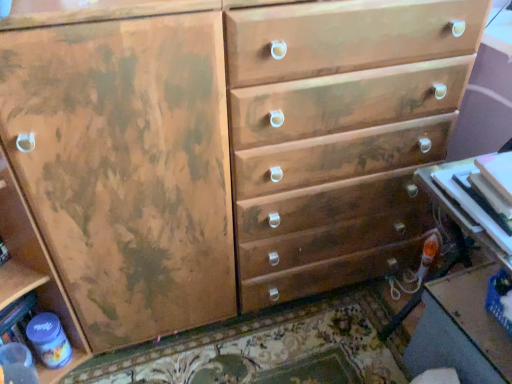
What do you see at coordinates (461, 330) in the screenshot?
I see `matte plastic table at lower right, the first table when ordered from back to front` at bounding box center [461, 330].

In order to face matte plastic bottle at lower left, should I rotate leftwards or rightwards?

Rotate your view left by about 25.345°.

This screenshot has height=384, width=512. What do you see at coordinates (466, 207) in the screenshot?
I see `white glossy table at lower right, which ranks as the 1th table in front-to-back order` at bounding box center [466, 207].

At what (x,y) coordinates should I click in order to perform the action: click on matte plastic table at lower right, marked as the first table in a bottom-to-top arrangement. Please return your answer as a coordinate pair (x, y). Looking at the image, I should click on (461, 330).

Is point (481, 291) closer to camera compared to point (41, 315)?

Yes, point (481, 291) is closer to viewer.

Is matte plastic table at lower right, which is counted as the second table, starting from the front, aimed at matte plastic bottle at lower left?

No, matte plastic table at lower right, which is counted as the second table, starting from the front, is not facing towards matte plastic bottle at lower left.

Are matte plastic table at lower right, acting as the second table starting from the top, and matte plastic bottle at lower left making contact?

No.

From the image's perspective, which one is positioned higher, white glossy table at lower right, which ranks as the 1th table in front-to-back order, or matte plastic bottle at lower left?

white glossy table at lower right, which ranks as the 1th table in front-to-back order.

Could you tell me if white glossy table at lower right, the 2th table positioned from the bottom, is facing matte plastic bottle at lower left?

No, white glossy table at lower right, the 2th table positioned from the bottom, is not facing towards matte plastic bottle at lower left.

Is white glossy table at lower right, the 2th table positioned from the bottom, taller than matte plastic bottle at lower left?

In fact, white glossy table at lower right, the 2th table positioned from the bottom, may be shorter than matte plastic bottle at lower left.

Does white glossy table at lower right, which ranks as the 1th table in front-to-back order, touch matte plastic bottle at lower left?

No.

From the image's perspective, which is above, matte plastic table at lower right, acting as the second table starting from the top, or white glossy table at lower right, which ranks as the 1th table in front-to-back order?

From the image's view, white glossy table at lower right, which ranks as the 1th table in front-to-back order, is above.

Measure the distance from matte plastic table at lower right, marked as the first table in a bottom-to-top arrangement, to white glossy table at lower right, positioned as the 2th table in back-to-front order.

matte plastic table at lower right, marked as the first table in a bottom-to-top arrangement, is 10.59 inches from white glossy table at lower right, positioned as the 2th table in back-to-front order.

Looking at this image, would you say matte plastic table at lower right, the first table when ordered from back to front, is a long distance from white glossy table at lower right, which ranks as the 1th table in front-to-back order?

No.

In terms of height, does matte plastic table at lower right, which is counted as the second table, starting from the front, look taller or shorter compared to white glossy table at lower right, the 2th table positioned from the bottom?

matte plastic table at lower right, which is counted as the second table, starting from the front, is taller than white glossy table at lower right, the 2th table positioned from the bottom.

Does point (433, 173) come farther from viewer compared to point (468, 317)?

No, it is not.

From a real-world perspective, which is physically above, white glossy table at lower right, positioned as the 2th table in back-to-front order, or matte plastic table at lower right, acting as the second table starting from the top?

white glossy table at lower right, positioned as the 2th table in back-to-front order, is physically above.

Based on the photo, could you tell me if white glossy table at lower right, the 2th table positioned from the bottom, is turned towards matte plastic table at lower right, the first table when ordered from back to front?

No, white glossy table at lower right, the 2th table positioned from the bottom, is not facing towards matte plastic table at lower right, the first table when ordered from back to front.

Between white glossy table at lower right, positioned as the 2th table in back-to-front order, and matte plastic table at lower right, marked as the first table in a bottom-to-top arrangement, which one has smaller size?

Smaller between the two is white glossy table at lower right, positioned as the 2th table in back-to-front order.

Is matte plastic bottle at lower left shorter than matte plastic table at lower right, which is counted as the second table, starting from the front?

Correct, matte plastic bottle at lower left is not as tall as matte plastic table at lower right, which is counted as the second table, starting from the front.

Looking at this image, does matte plastic bottle at lower left have a larger size compared to matte plastic table at lower right, marked as the first table in a bottom-to-top arrangement?

No.

Where is `bottle behind the matte plastic table at lower right, the first table when ordered from back to front`? bottle behind the matte plastic table at lower right, the first table when ordered from back to front is located at coordinates (49, 340).

From a real-world perspective, is matte plastic bottle at lower left located beneath white glossy table at lower right, which ranks as the 1th table in front-to-back order?

Yes, from a real-world perspective, matte plastic bottle at lower left is under white glossy table at lower right, which ranks as the 1th table in front-to-back order.

Between point (48, 317) and point (511, 243), which one is positioned in front?

The point (511, 243) is more forward.

Between matte plastic bottle at lower left and white glossy table at lower right, positioned as the 2th table in back-to-front order, which one has larger width?

white glossy table at lower right, positioned as the 2th table in back-to-front order.

Between matte plastic bottle at lower left and white glossy table at lower right, positioned as the 2th table in back-to-front order, which one has larger size?

Bigger between the two is white glossy table at lower right, positioned as the 2th table in back-to-front order.

Find the location of `the 2nd table to the right of the matte plastic bottle at lower left, starting your count from the anchor`. the 2nd table to the right of the matte plastic bottle at lower left, starting your count from the anchor is located at coordinates (461, 330).

Locate an element on the screen. The image size is (512, 384). the 2nd table located above the matte plastic bottle at lower left (from a real-world perspective) is located at coordinates (466, 207).

Looking at the image, which one is located further to matte plastic table at lower right, acting as the second table starting from the top, white glossy table at lower right, the 2th table positioned from the bottom, or matte plastic bottle at lower left?

The object further to matte plastic table at lower right, acting as the second table starting from the top, is matte plastic bottle at lower left.

Estimate the real-world distances between objects in this image. Which object is further from white glossy table at lower right, the first table in the top-to-bottom sequence, matte plastic table at lower right, the first table when ordered from back to front, or matte plastic bottle at lower left?

The object further to white glossy table at lower right, the first table in the top-to-bottom sequence, is matte plastic bottle at lower left.

When comparing their distances from matte plastic bottle at lower left, does white glossy table at lower right, which ranks as the 1th table in front-to-back order, or matte plastic table at lower right, acting as the second table starting from the top, seem closer?

matte plastic table at lower right, acting as the second table starting from the top, is positioned closer to the anchor matte plastic bottle at lower left.

Looking at the image, which one is located further to matte plastic bottle at lower left, matte plastic table at lower right, the first table when ordered from back to front, or white glossy table at lower right, the first table in the top-to-bottom sequence?

white glossy table at lower right, the first table in the top-to-bottom sequence, lies further to matte plastic bottle at lower left than the other object.

When comparing their distances from matte plastic table at lower right, which is counted as the second table, starting from the front, does matte plastic bottle at lower left or white glossy table at lower right, the first table in the top-to-bottom sequence, seem further?

matte plastic bottle at lower left.

Estimate the real-world distances between objects in this image. Which object is further from white glossy table at lower right, which ranks as the 1th table in front-to-back order, matte plastic bottle at lower left or matte plastic table at lower right, the first table when ordered from back to front?

matte plastic bottle at lower left is further to white glossy table at lower right, which ranks as the 1th table in front-to-back order.

Locate an element on the screen. The height and width of the screenshot is (384, 512). table located between matte plastic bottle at lower left and matte plastic table at lower right, marked as the first table in a bottom-to-top arrangement, in the left-right direction is located at coordinates (466, 207).